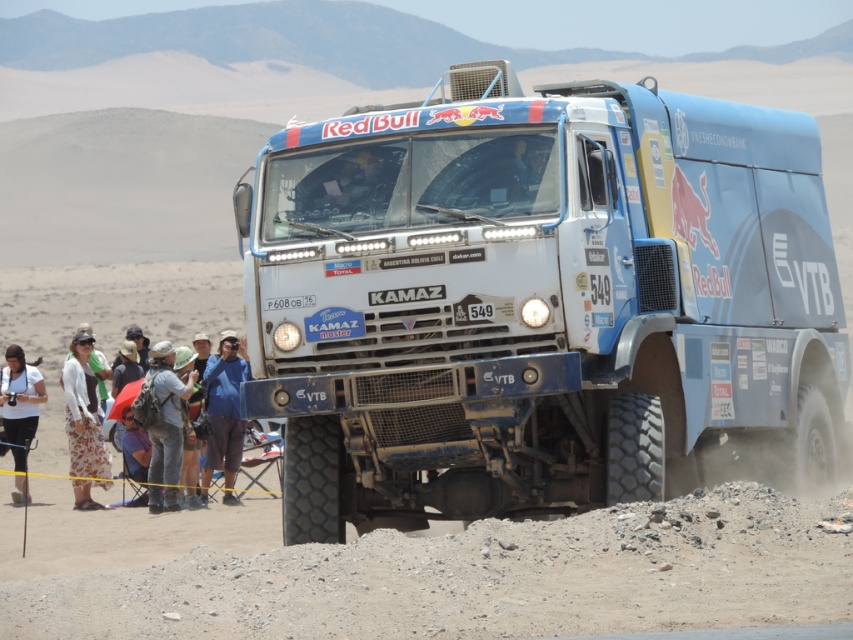
Question: Is blue denim jacket at lower left wider than floral print skirt at lower left?

Choices:
 (A) yes
 (B) no

Answer: (B)

Question: Which point is farther from the camera taking this photo?

Choices:
 (A) (3, 369)
 (B) (619, 342)

Answer: (A)

Question: Which point appears farthest from the camera in this image?

Choices:
 (A) (648, 490)
 (B) (167, 586)

Answer: (A)

Question: Which is farther from the blue fabric pants at lower left?

Choices:
 (A) white cotton shirt at lower left
 (B) black rubber tire at lower center

Answer: (B)

Question: Can you confirm if black rubber tire at lower right is thinner than sandy rubber tire at lower right?

Choices:
 (A) yes
 (B) no

Answer: (A)

Question: Can you confirm if black rubber tire at lower center is positioned to the left of denim jacket at lower left?

Choices:
 (A) yes
 (B) no

Answer: (B)